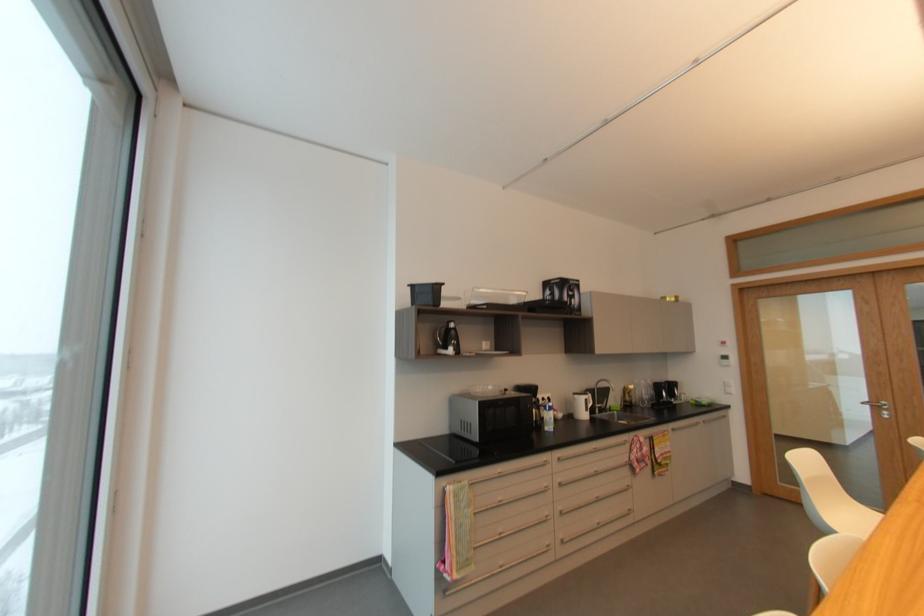
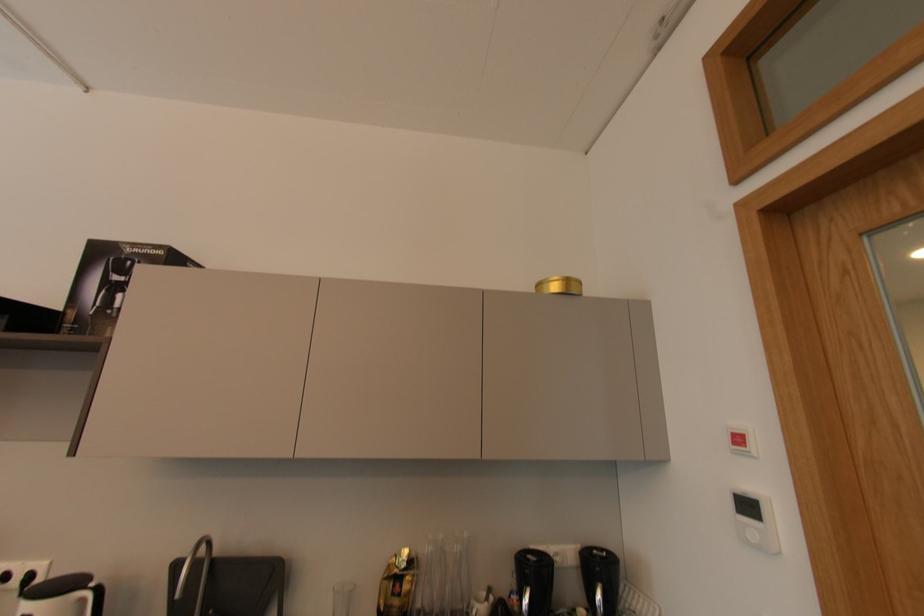
In a continuous first-person perspective shot, in which direction is the camera moving?

The cameraman moved toward right, forward.